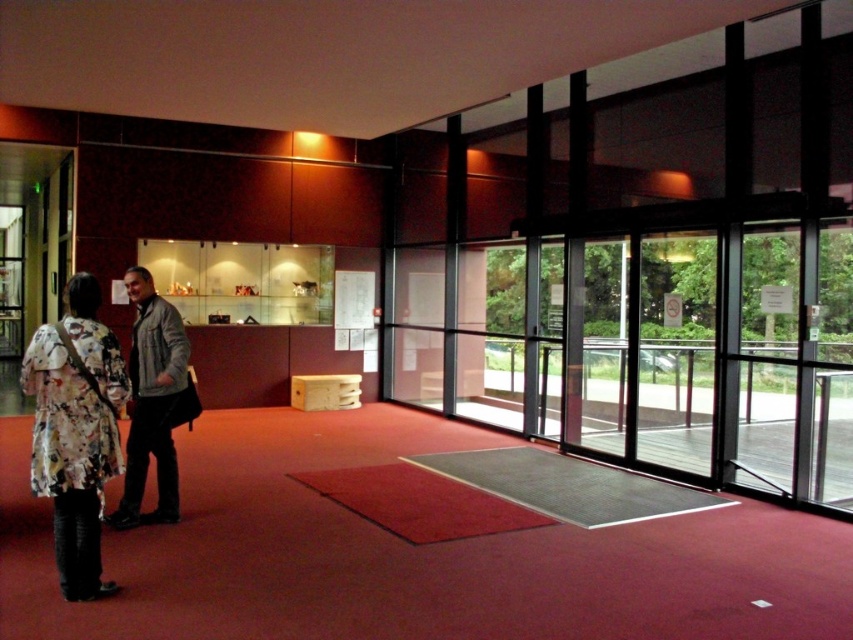
Question: Can you confirm if floral fabric dress at left is bigger than gray fabric jacket at center?

Choices:
 (A) yes
 (B) no

Answer: (B)

Question: Which object is closer to the camera taking this photo?

Choices:
 (A) floral fabric dress at left
 (B) gray fabric jacket at center

Answer: (A)

Question: Is floral fabric dress at left closer to camera compared to gray fabric jacket at center?

Choices:
 (A) yes
 (B) no

Answer: (A)

Question: Which point is closer to the camera?

Choices:
 (A) (61, 362)
 (B) (136, 490)

Answer: (A)

Question: Is floral fabric dress at left in front of gray fabric jacket at center?

Choices:
 (A) yes
 (B) no

Answer: (A)